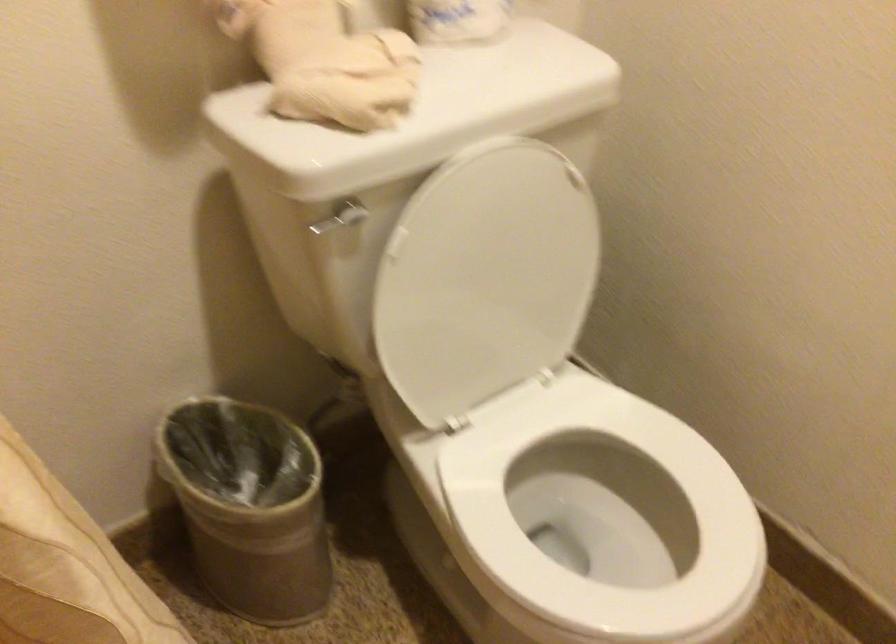
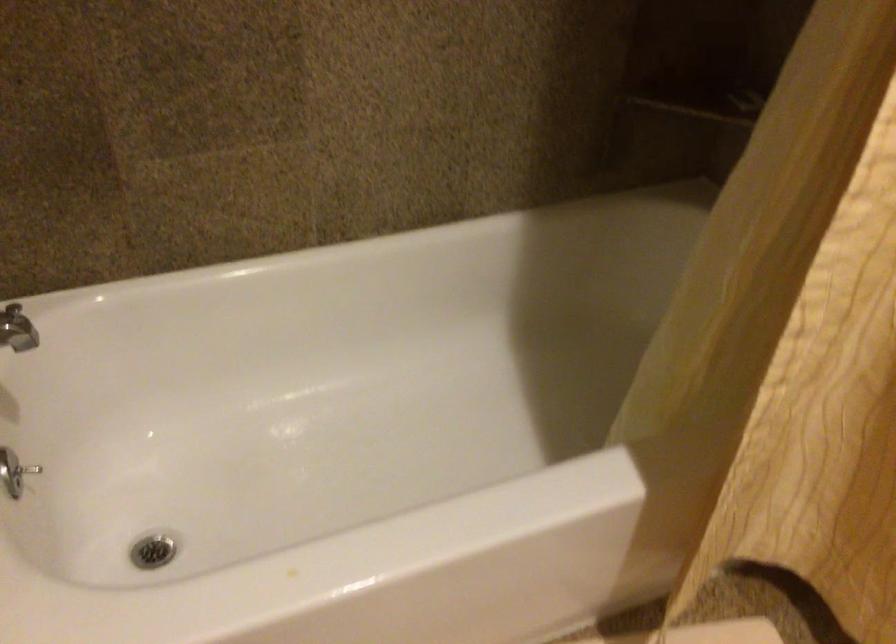
Based on the continuous images, in which direction is the camera rotating?

The camera's rotation is toward left-down.